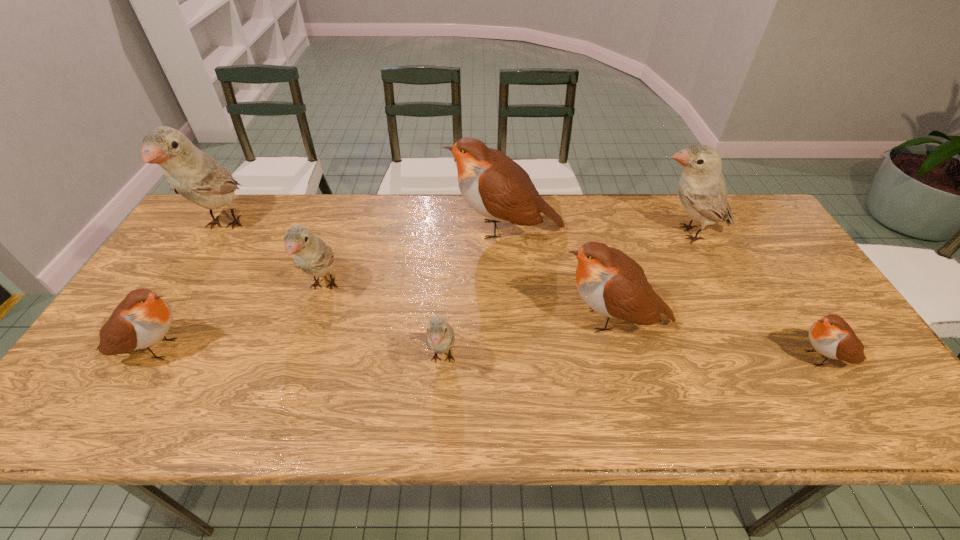
Locate which bird is the sixth closest to the third smallest brown bird. Please provide its 2D coordinates. Your answer should be formatted as a tuple, i.e. [(x, y)], where the tuple contains the x and y coordinates of a point satisfying the conditions above.

[(142, 319)]

Locate an element on the screen. The width and height of the screenshot is (960, 540). the closest white bird to the third white bird from left to right is located at coordinates (310, 253).

The image size is (960, 540). What are the coordinates of `white bird that can be found as the second closest to the leftmost brown bird` in the screenshot? It's located at (190, 172).

This screenshot has height=540, width=960. I want to click on the closest brown bird to the second nearest white bird, so click(142, 319).

Locate an element on the screen. brown bird object that ranks as the third closest to the nearest white bird is located at coordinates coord(142,319).

At what (x,y) coordinates should I click in order to perform the action: click on vacant region that satisfies the following two spatial constraints: 1. at the face of the second smallest white bird; 2. at the face of the leftmost brown bird. Please return your answer as a coordinate pair (x, y). Looking at the image, I should click on (303, 349).

You are a GUI agent. You are given a task and a screenshot of the screen. Output one action in this format:
    pyautogui.click(x=<x>, y=<y>)
    Task: Click on the vacant space that satisfies the following two spatial constraints: 1. at the face of the third biggest white bird; 2. at the face of the second smallest brown bird
    Image resolution: width=960 pixels, height=540 pixels.
    Given the screenshot: What is the action you would take?
    pyautogui.click(x=303, y=349)

Image resolution: width=960 pixels, height=540 pixels. I want to click on free space in the image that satisfies the following two spatial constraints: 1. at the face of the second biggest brown bird; 2. at the face of the nearest white bird, so click(x=624, y=359).

Locate an element on the screen. This screenshot has width=960, height=540. vacant region that satisfies the following two spatial constraints: 1. at the face of the biggest brown bird; 2. at the face of the third biggest white bird is located at coordinates (509, 287).

Locate an element on the screen. blank space that satisfies the following two spatial constraints: 1. at the face of the rightmost white bird; 2. at the face of the sixth bird from right to left is located at coordinates (714, 287).